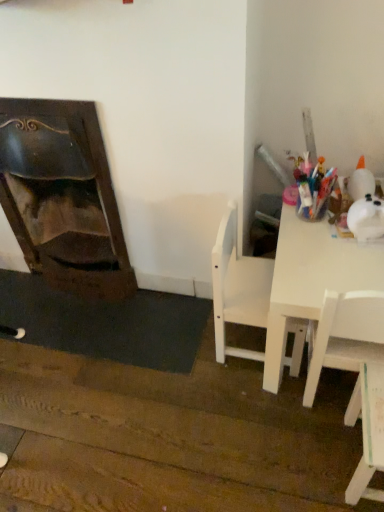
Identify the location of free spot above white glossy table at right (from a real-world perspective). The width and height of the screenshot is (384, 512). (327, 250).